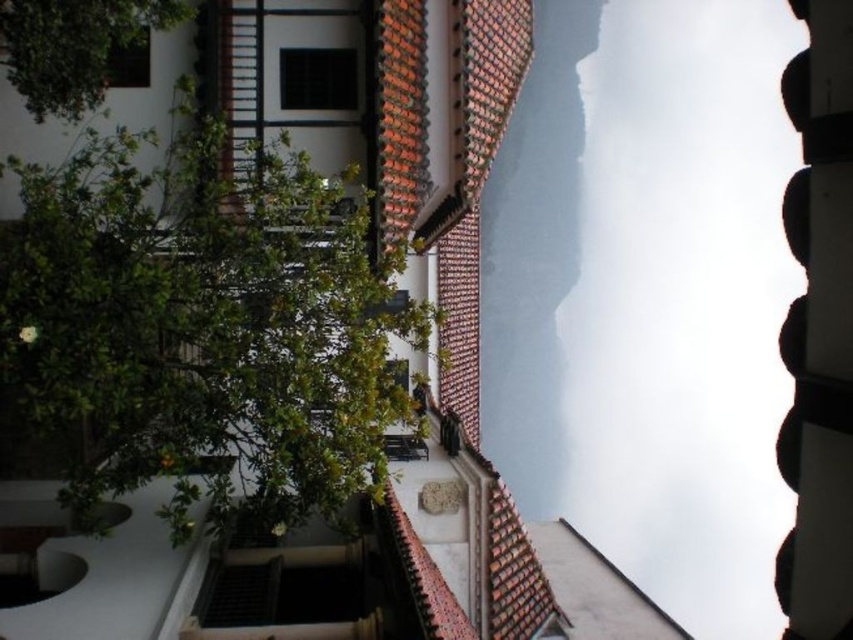
Question: Does green leafy tree at center appear on the left side of transparent glass window at upper center?

Choices:
 (A) yes
 (B) no

Answer: (A)

Question: Estimate the real-world distances between objects in this image. Which object is closer to the green leafy tree at center?

Choices:
 (A) transparent glass window at upper center
 (B) black glass window at upper left

Answer: (A)

Question: Observing the image, what is the correct spatial positioning of green leafy tree at upper left in reference to transparent glass window at upper center?

Choices:
 (A) above
 (B) below

Answer: (B)

Question: Based on their relative distances, which object is nearer to the green leafy tree at center?

Choices:
 (A) transparent glass window at upper center
 (B) green leafy tree at upper left
 (C) black glass window at upper left

Answer: (B)

Question: Considering the relative positions of green leafy tree at upper left and black glass window at upper left in the image provided, where is green leafy tree at upper left located with respect to black glass window at upper left?

Choices:
 (A) below
 (B) above

Answer: (A)

Question: Based on their relative distances, which object is farther from the black glass window at upper left?

Choices:
 (A) transparent glass window at upper center
 (B) green leafy tree at center
 (C) green leafy tree at upper left

Answer: (B)